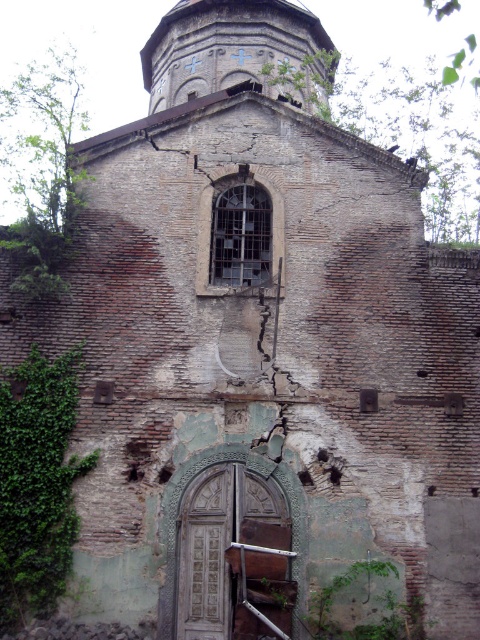
Does green leafy ivy at lower left have a lesser width compared to wooden carved door at center?

Yes, green leafy ivy at lower left is thinner than wooden carved door at center.

Is point (63, 356) positioned after point (260, 531)?

That is True.

Locate an element on the screen. green leafy ivy at lower left is located at coordinates (36, 483).

I want to click on green leafy ivy at lower left, so click(36, 483).